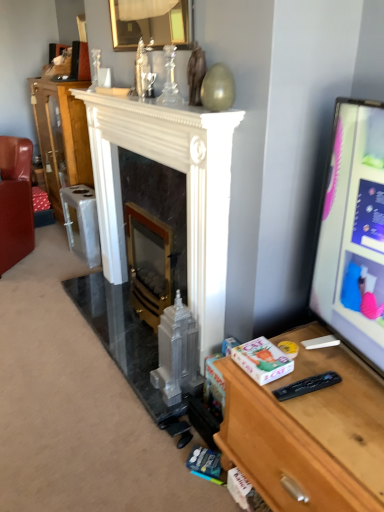
Question: In the image, is white marble fireplace at center, acting as the second fireplace starting from the right, on the left side or the right side of wooden desk at right?

Choices:
 (A) right
 (B) left

Answer: (B)

Question: Relative to wooden desk at right, is white marble fireplace at center, acting as the second fireplace starting from the right, in front or behind?

Choices:
 (A) behind
 (B) front

Answer: (A)

Question: Which object is positioned closest to the wooden desk at right?

Choices:
 (A) white marble fireplace at center, arranged as the 1th fireplace when viewed from the left
 (B) white marble fireplace at center
 (C) leather couch at left
 (D) gold metallic fireplace at center, positioned as the 2th fireplace in left-to-right order
 (E) matte black monitor at right

Answer: (E)

Question: Which of these objects is positioned closest to the white marble fireplace at center, arranged as the 1th fireplace when viewed from the left?

Choices:
 (A) white marble fireplace at center
 (B) leather couch at left
 (C) gold metallic fireplace at center, positioned as the 2th fireplace in left-to-right order
 (D) matte black monitor at right
 (E) wooden desk at right

Answer: (C)